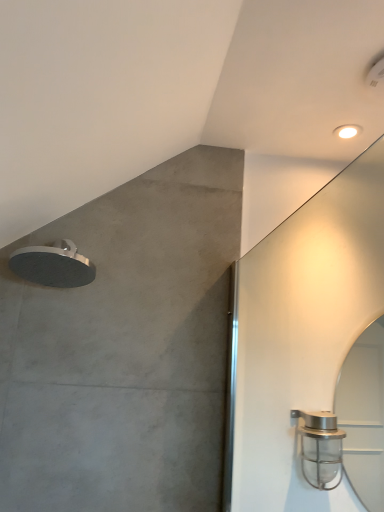
Question: Considering the positions of white glossy droplight at upper right and satin nickel shower head at right, the second shower when ordered from left to right, in the image, is white glossy droplight at upper right wider or thinner than satin nickel shower head at right, the second shower when ordered from left to right,?

Choices:
 (A) thin
 (B) wide

Answer: (A)

Question: Is white glossy droplight at upper right taller or shorter than satin nickel shower head at right, which is the 1th shower in right-to-left order?

Choices:
 (A) short
 (B) tall

Answer: (A)

Question: Which of these objects is positioned closest to the white glossy droplight at upper right?

Choices:
 (A) satin nickel shower head at right, which is the 1th shower in right-to-left order
 (B) satin silver showerhead at upper left, placed as the 1th shower when sorted from left to right

Answer: (A)

Question: Which object is the closest to the satin silver showerhead at upper left, which is the 2th shower in bottom-to-top order?

Choices:
 (A) white glossy droplight at upper right
 (B) satin nickel shower head at right, which is the 1th shower in right-to-left order

Answer: (B)